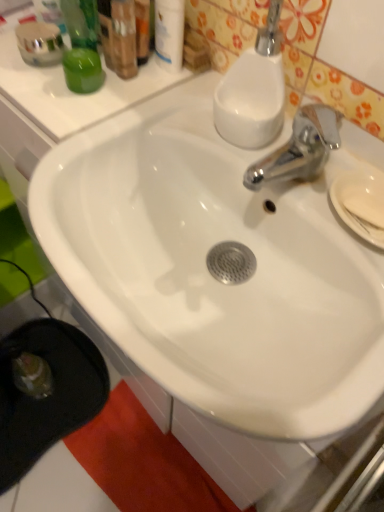
Where is `vacant space positioned to the left of white matte soap at right`? vacant space positioned to the left of white matte soap at right is located at coordinates (284, 179).